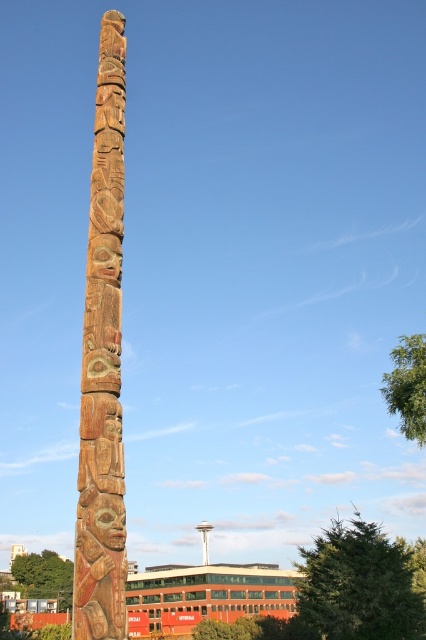
You are standing in front of the wooden totem pole at center and the green leafy tree at lower left. Which object is closer to you?

The wooden totem pole at center is closer to you because it is positioned over the green leafy tree at lower left, indicating it is in front.

You are standing in front of the totem pole and want to take a photo that includes both the totem pole and the green leafy tree at upper right. Based on their positions, where should you position yourself to ensure both are in the frame?

You should position yourself to the left of the totem pole so that both the totem pole on the left and the green leafy tree at upper right are within your camera frame.

Looking at this image, you are standing in front of the totem pole and want to touch both the point at location (391, 397) and the point at (60, 572). Which point will require you to reach further out?

The point at (60, 572) will require reaching further because it is farther from the viewer compared to the point at (391, 397).